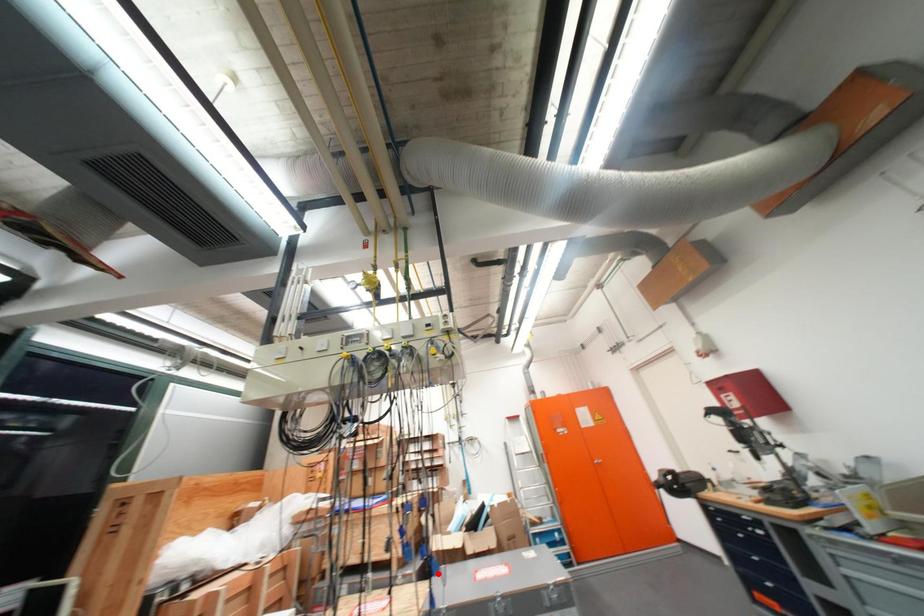
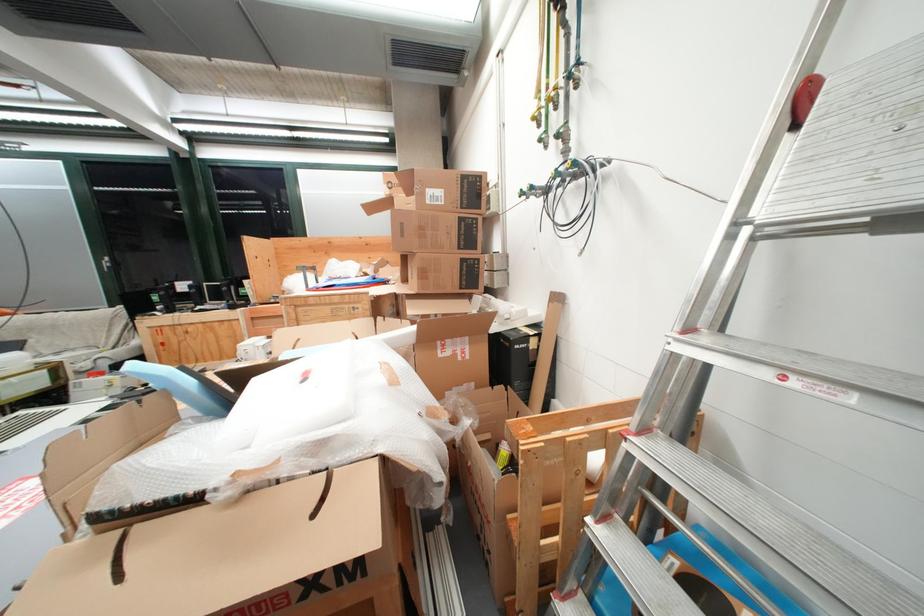
Question: I am providing you with two images of the same scene from different viewpoints. A red point is marked on the first image. At the location where the point appears in image 1, is it still visible in image 2?

Choices:
 (A) Yes
 (B) No

Answer: (B)